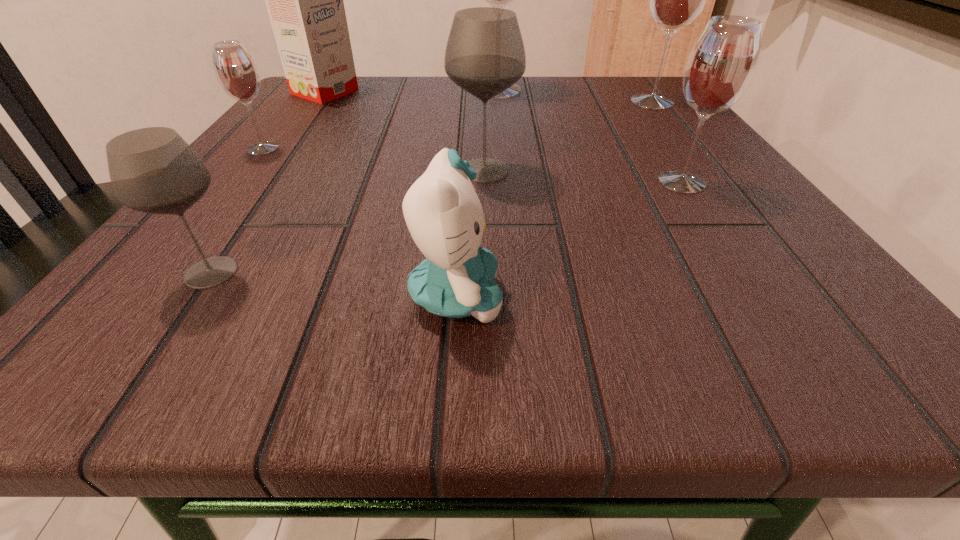
You are a GUI agent. You are given a task and a screenshot of the screen. Output one action in this format:
    pyautogui.click(x=<x>, y=<y>)
    Task: Click on the second red wineglass from left to right
    Image resolution: width=960 pixels, height=540 pixels.
    Given the screenshot: What is the action you would take?
    pyautogui.click(x=499, y=0)

Find the location of a particular element. The width and height of the screenshot is (960, 540). the biggest red wineglass is located at coordinates (499, 0).

Locate an element on the screen. carton is located at coordinates (304, 0).

Find the location of `the third smallest red wineglass`. the third smallest red wineglass is located at coordinates (675, 0).

Find the location of a particular element. the right gray wineglass is located at coordinates (485, 55).

Where is `the bigger gray wineglass`? The width and height of the screenshot is (960, 540). the bigger gray wineglass is located at coordinates (485, 55).

You are a GUI agent. You are given a task and a screenshot of the screen. Output one action in this format:
    pyautogui.click(x=<x>, y=<y>)
    Task: Click on the nearest red wineglass
    
    Given the screenshot: What is the action you would take?
    pyautogui.click(x=721, y=65)

The height and width of the screenshot is (540, 960). I want to click on the leftmost red wineglass, so (x=236, y=72).

Find the location of a particular element. The width and height of the screenshot is (960, 540). the smallest red wineglass is located at coordinates (236, 72).

Locate an element on the screen. The image size is (960, 540). the nearest wineglass is located at coordinates (153, 170).